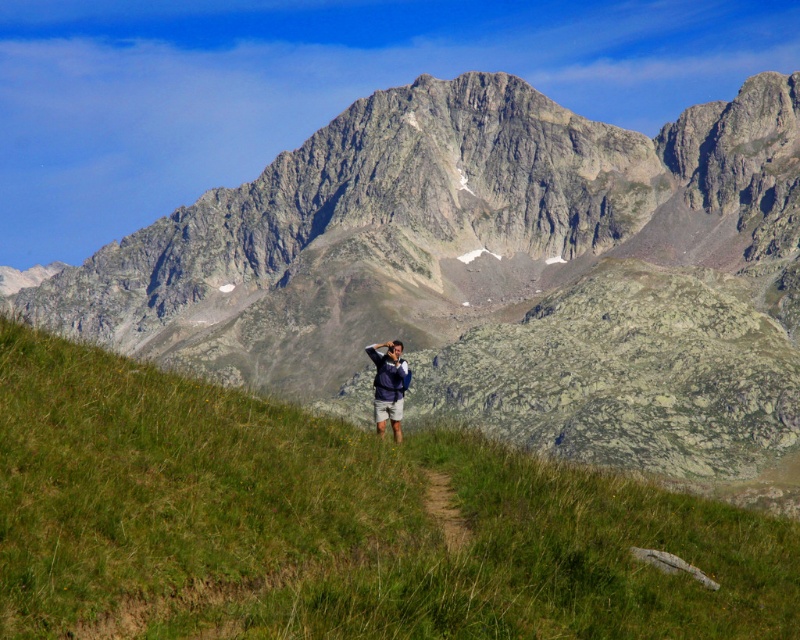
In the scene shown: Can you confirm if gray rocky mountain at center is positioned to the right of green grassy at center?

Yes, gray rocky mountain at center is to the right of green grassy at center.

Does gray rocky mountain at center come behind green grassy at center?

Yes, gray rocky mountain at center is further from the viewer.

Locate an element on the screen. Image resolution: width=800 pixels, height=640 pixels. gray rocky mountain at center is located at coordinates (498, 275).

Which of these two, green grassy at center or matte blue jacket at center, stands shorter?

Standing shorter between the two is matte blue jacket at center.

Does green grassy at center have a larger size compared to matte blue jacket at center?

Yes, green grassy at center is bigger than matte blue jacket at center.

Between point (32, 560) and point (380, 387), which one is positioned behind?

The point (380, 387) is behind.

At what (x,y) coordinates should I click in order to perform the action: click on green grassy at center. Please return your answer as a coordinate pair (x, y). This screenshot has height=640, width=800. Looking at the image, I should click on (333, 524).

Measure the distance between gray rocky mountain at center and matte blue jacket at center.

gray rocky mountain at center and matte blue jacket at center are 64.93 meters apart.

Measure the distance between gray rocky mountain at center and camera.

A distance of 206.24 feet exists between gray rocky mountain at center and camera.

Is point (701, 294) less distant than point (384, 342)?

That is False.

Locate an element on the screen. Image resolution: width=800 pixels, height=640 pixels. gray rocky mountain at center is located at coordinates coord(498,275).